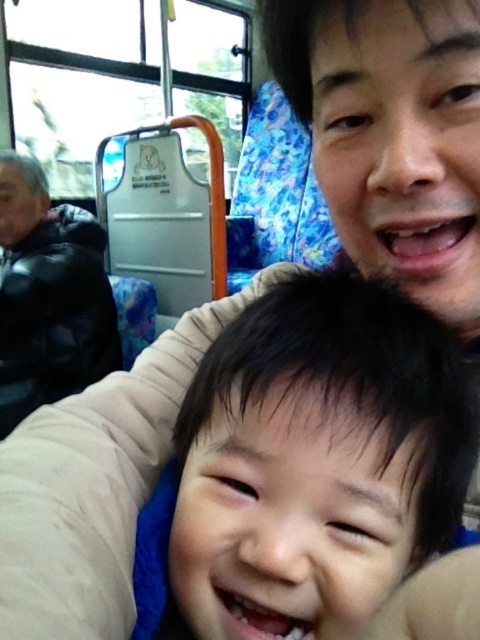
Question: Which of these objects is positioned farthest from the black matte hair at center?

Choices:
 (A) smooth skin face at upper right
 (B) black fuzzy jacket at left

Answer: (B)

Question: Which point is farther to the camera?

Choices:
 (A) (453, 54)
 (B) (244, 595)

Answer: (A)

Question: Is black matte hair at center positioned before black fuzzy jacket at left?

Choices:
 (A) yes
 (B) no

Answer: (A)

Question: Which object appears farthest from the camera in this image?

Choices:
 (A) black matte hair at center
 (B) black fuzzy jacket at left
 (C) smooth skin face at upper right

Answer: (B)

Question: In this image, where is black matte hair at center located relative to black fuzzy jacket at left?

Choices:
 (A) above
 (B) below

Answer: (B)

Question: From the image, what is the correct spatial relationship of black matte hair at center in relation to smooth skin face at upper right?

Choices:
 (A) left
 (B) right

Answer: (A)